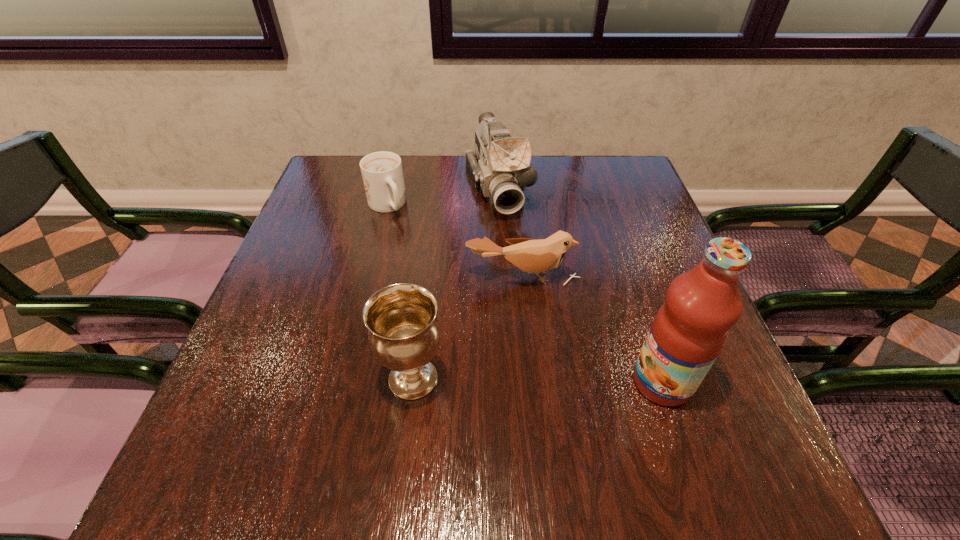
You are a GUI agent. You are given a task and a screenshot of the screen. Output one action in this format:
    pyautogui.click(x=<x>, y=<y>)
    Task: Click on the vacant spot on the desktop that is between the fourth object from right to left and the tallest object and is positioned at the beak of the third farthest object
    This screenshot has width=960, height=540.
    Given the screenshot: What is the action you would take?
    pyautogui.click(x=526, y=380)

I want to click on vacant space on the desktop that is between the chalice and the fruit juice and is positioned on the side with the handle of the leftmost object, so click(501, 380).

Find the location of `vacant space on the desktop that is between the second object from left to right and the fruit juice and is positioned on the front-facing side of the camcorder`. vacant space on the desktop that is between the second object from left to right and the fruit juice and is positioned on the front-facing side of the camcorder is located at coordinates (572, 381).